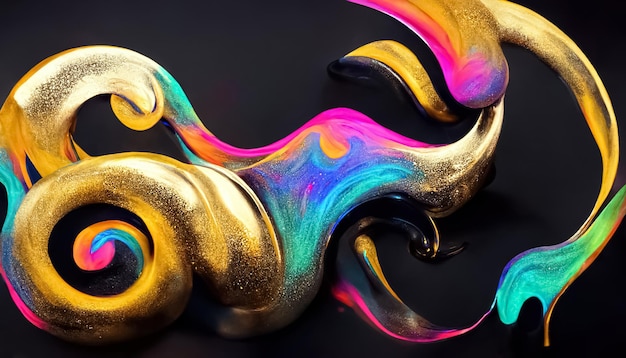
Find the location of a particular element. blue paint is located at coordinates (515, 303).